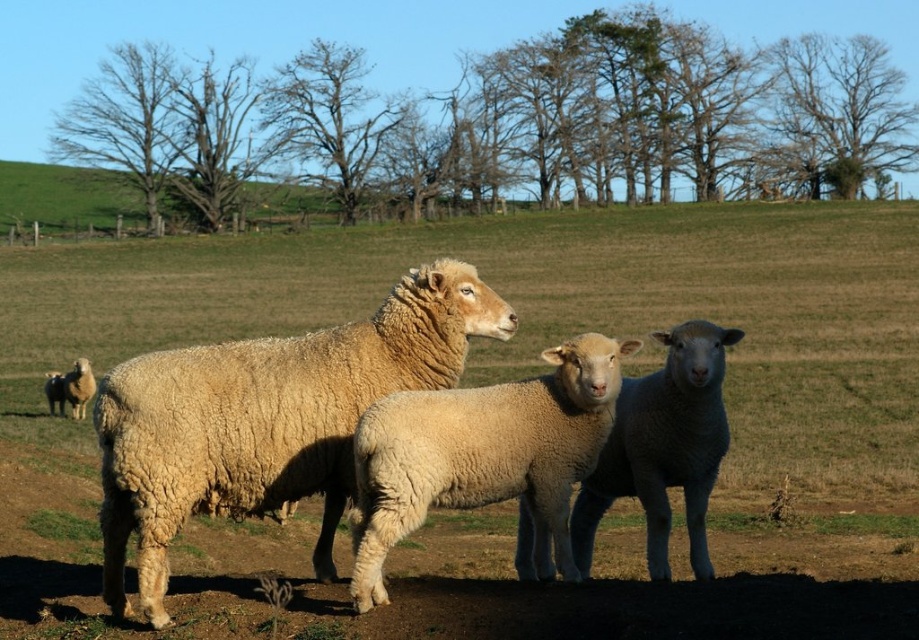
You are a drone operator trying to capture a photo of the green soft grass at center and the white woolen sheep at center. From your current position, which object is higher in the frame?

The green soft grass at center is above the white woolen sheep at center in the frame.

You are standing in the middle of the field in the image. Looking down, you notice a specific point where the ground has green soft grass at center. What are the coordinates of that point?

The coordinates of the green soft grass at center are at point (519,355).

You are a gardener planning to plant flowers in the field where the green soft grass at center and the fuzzy woolen lamb at center are located. If the grass area is wider than the lamb, which area would you choose to plant the flowers to ensure they have enough space to grow?

The green soft grass at center has a greater width than the fuzzy woolen lamb at center, so planting flowers in the green soft grass at center would provide more space for growth.